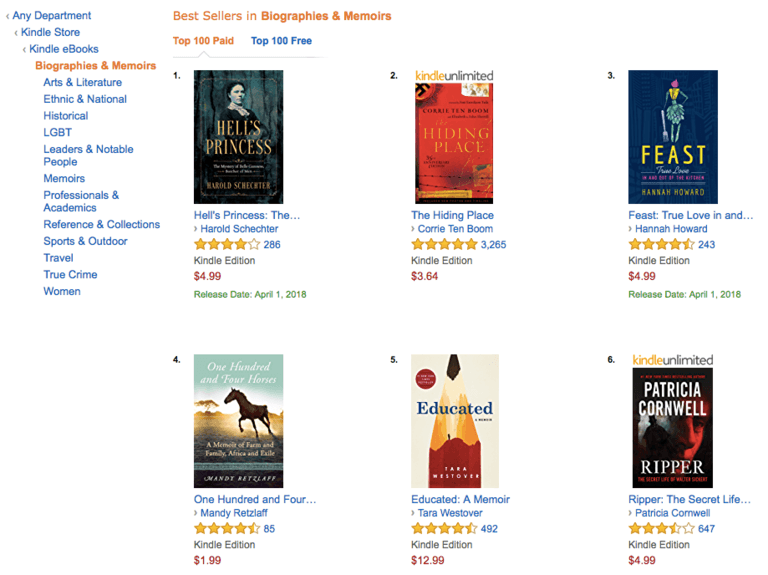
Locate an element on the screen. book is located at coordinates (260, 166), (449, 139), (672, 155), (690, 426), (465, 424), (237, 430).